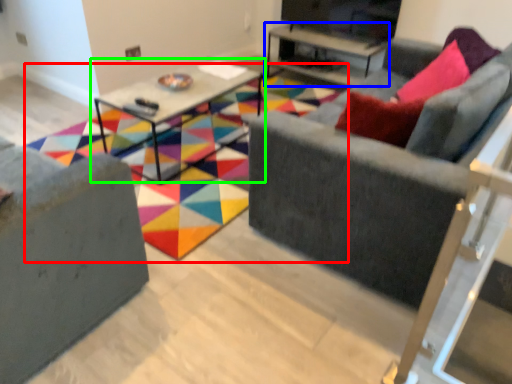
Question: Based on their relative distances, which object is farther from pattern (highlighted by a red box)? Choose from table (highlighted by a blue box) and table (highlighted by a green box).

Choices:
 (A) table
 (B) table

Answer: (A)